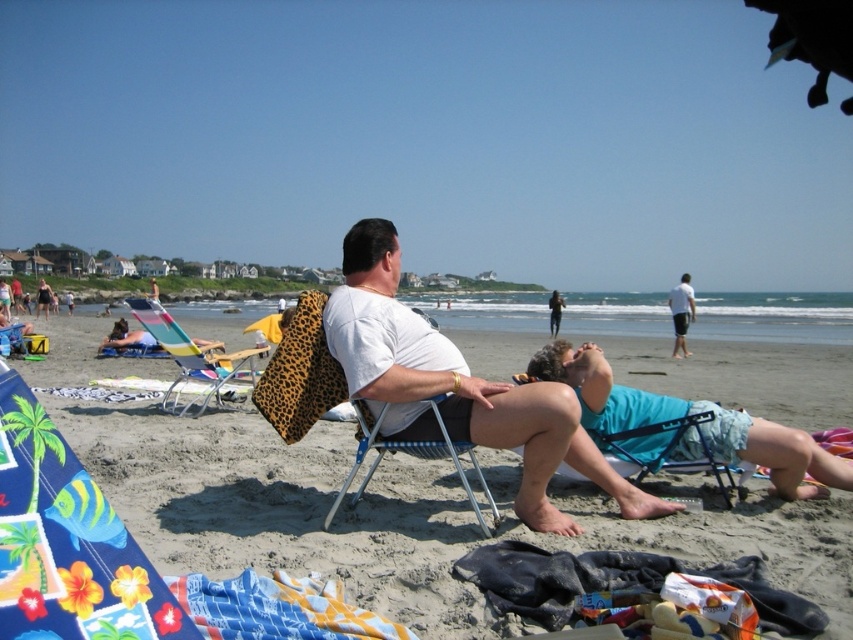
You are a photographer trying to capture a candid shot of the person in the white matte shirt at center and the metallic blue beach chair at center. From your current position, which object is closer to the right edge of the frame?

The white matte shirt at center is positioned on the right side of metallic blue beach chair at center, so the white matte shirt at center is closer to the right edge of the frame.

You are a photographer trying to capture a shot of the leopard print cushion at center and the metallic blue beach chair at center. Which object is positioned higher in the image?

The leopard print cushion at center is located above the metallic blue beach chair at center, so it is positioned higher in the image.

You are planning to place a leopard print cushion at center and a metallic blue beach chair at center on a small deck. Given their sizes, which item will require more space horizontally?

The metallic blue beach chair at center requires more horizontal space since its width is greater than the leopard print cushion at center.